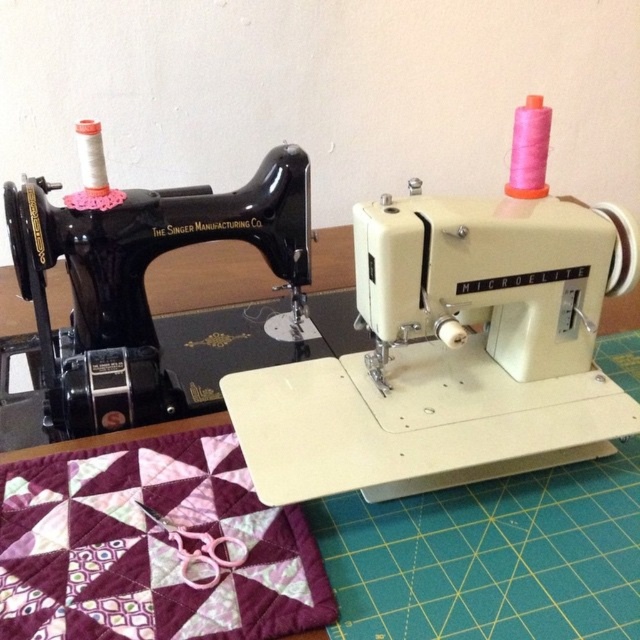
Question: Can you confirm if white plastic sewing machine at center is bigger than black glossy singer manufacturing co sewing machine at left?

Choices:
 (A) yes
 (B) no

Answer: (A)

Question: Which object appears closest to the camera in this image?

Choices:
 (A) white plastic sewing machine at center
 (B) black glossy singer manufacturing co sewing machine at left

Answer: (A)

Question: Which object appears closest to the camera in this image?

Choices:
 (A) black glossy singer manufacturing co sewing machine at left
 (B) white plastic sewing machine at center

Answer: (B)

Question: Is white plastic sewing machine at center smaller than black glossy singer manufacturing co sewing machine at left?

Choices:
 (A) no
 (B) yes

Answer: (A)

Question: Which of the following is the farthest from the observer?

Choices:
 (A) white plastic sewing machine at center
 (B) black glossy singer manufacturing co sewing machine at left

Answer: (B)

Question: Where is white plastic sewing machine at center located in relation to black glossy singer manufacturing co sewing machine at left in the image?

Choices:
 (A) below
 (B) above

Answer: (A)